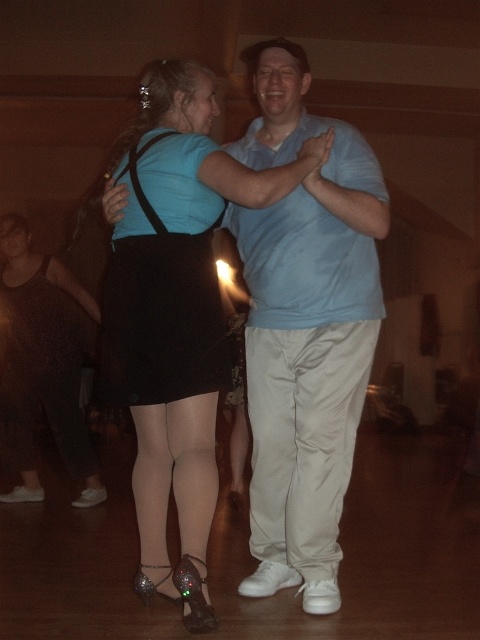
You are standing at the entrance of the dance hall and see two points marked on the floor. The first point is labeled as point [323,248] and the second is point [134,372]. If you want to move from the entrance to the point that is further away from you, which point should you head towards?

Point [323,248] is behind point [134,372], so you should head towards point [323,248] as it is further away from the entrance.

You are a photographer trying to capture both the matte black skirt at center and the black satin skirt at center in a single frame. Which skirt should you focus on first to ensure the larger one is properly framed?

The matte black skirt at center has a larger size compared to the black satin skirt at center, so you should focus on the matte black skirt at center first to ensure it is properly framed.